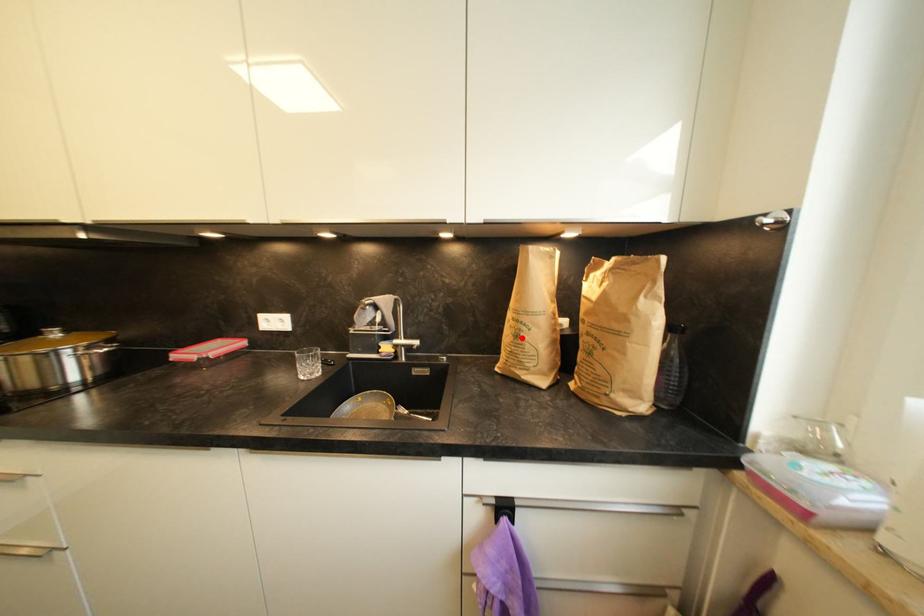
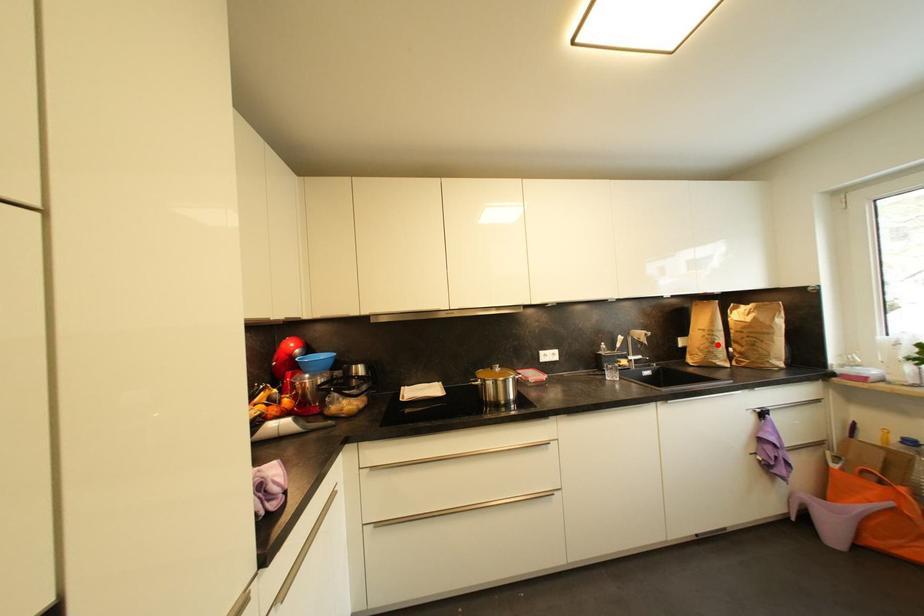
I am providing you with two images of the same scene from different viewpoints. A red point is marked on the first image and another point is marked on the second image. Is the red point in image1 aligned with the point shown in image2?

Yes